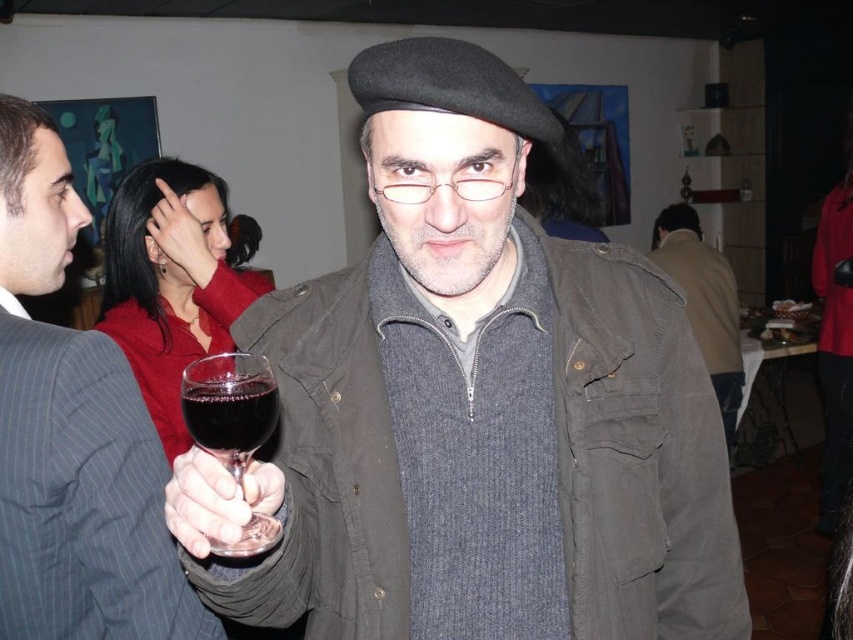
Question: Among these points, which one is farthest from the camera?

Choices:
 (A) (399, 173)
 (B) (30, 154)
 (C) (256, 435)

Answer: (B)

Question: Is matte black beret at center closer to the viewer compared to matte black hand at upper center?

Choices:
 (A) yes
 (B) no

Answer: (A)

Question: Which point is farther from the camera taking this photo?

Choices:
 (A) (12, 552)
 (B) (196, 250)
 (C) (676, 256)

Answer: (C)

Question: Considering the relative positions of transparent glass at center and gray wool sweater at center in the image provided, where is transparent glass at center located with respect to gray wool sweater at center?

Choices:
 (A) right
 (B) left

Answer: (B)

Question: Which point is closer to the camera?

Choices:
 (A) (248, 412)
 (B) (74, 460)

Answer: (A)

Question: Is matte black beret at center smaller than gray wool sweater at center?

Choices:
 (A) yes
 (B) no

Answer: (A)